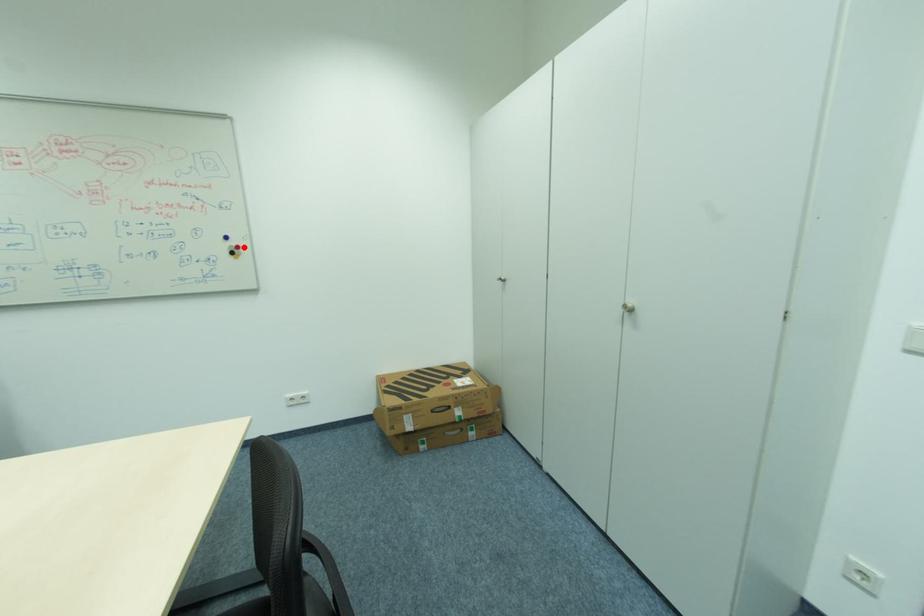
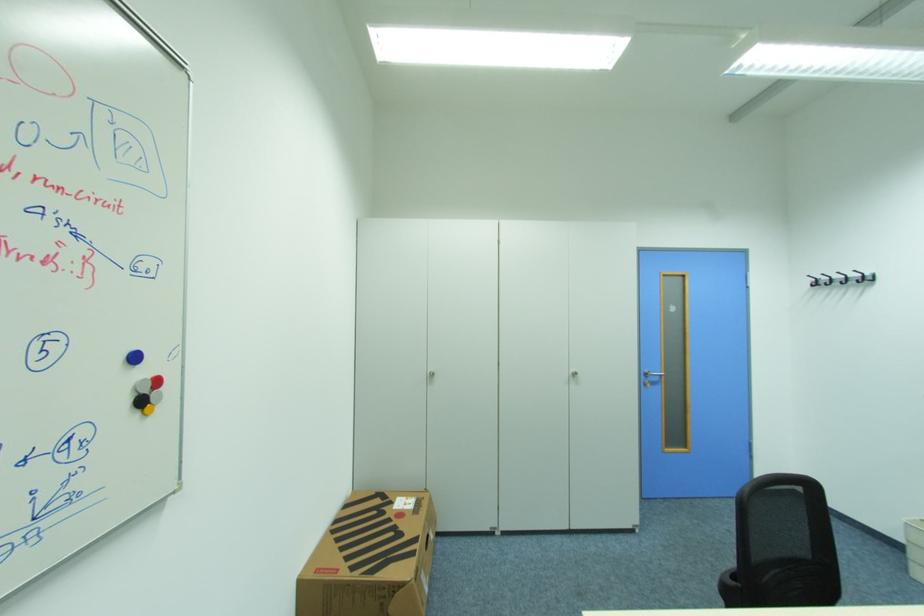
In the second image, find the point that corresponds to the highlighted location in the first image.

(162, 382)